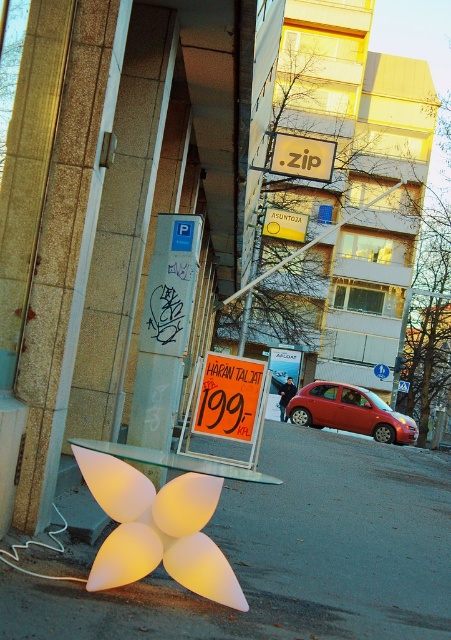
Does point (79, 456) lie in front of point (367, 412)?

Yes, it is in front of point (367, 412).

In the scene shown: Is translucent plastic flower at lower center positioned at the back of shiny red car at center?

That is False.

Who is more forward, (199, 566) or (391, 417)?

Positioned in front is point (199, 566).

Find the location of `translucent plastic flower at lower center`. translucent plastic flower at lower center is located at coordinates (157, 529).

Is yellow matte sign at upper center taller than yellow paper at center?

No, yellow matte sign at upper center is not taller than yellow paper at center.

Does yellow matte sign at upper center come in front of yellow paper at center?

Yes, it is.

You are a GUI agent. You are given a task and a screenshot of the screen. Output one action in this format:
    pyautogui.click(x=<x>, y=<y>)
    Task: Click on the yellow matte sign at upper center
    The height and width of the screenshot is (640, 451).
    Given the screenshot: What is the action you would take?
    pyautogui.click(x=302, y=157)

Between translucent plastic flower at lower center and yellow paper at center, which one is positioned lower?

Positioned lower is translucent plastic flower at lower center.

Is point (179, 515) closer to viewer compared to point (294, 234)?

Yes.

Image resolution: width=451 pixels, height=640 pixels. In order to click on translucent plastic flower at lower center in this screenshot , I will do `click(157, 529)`.